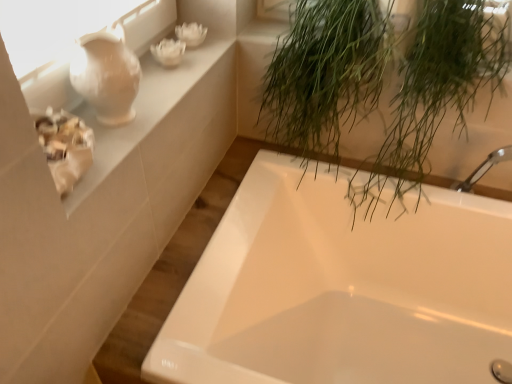
The image size is (512, 384). I want to click on free space to the back side of matte white vase at upper left, so click(162, 82).